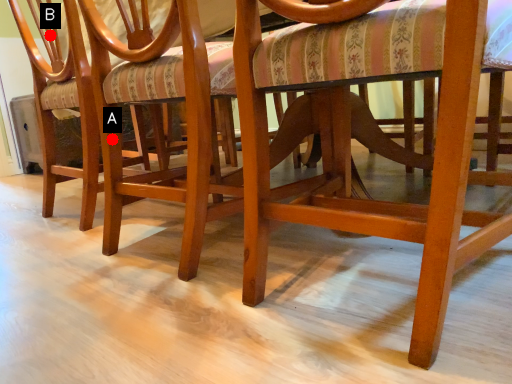
Question: Two points are circled on the image, labeled by A and B beside each circle. Which point is farther to the camera?

Choices:
 (A) A is further
 (B) B is further

Answer: (B)